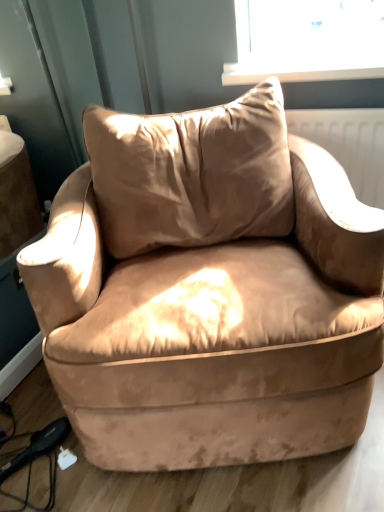
The image size is (384, 512). What do you see at coordinates (208, 291) in the screenshot?
I see `velvet beige armchair at center` at bounding box center [208, 291].

The height and width of the screenshot is (512, 384). I want to click on velvet beige armchair at center, so click(208, 291).

This screenshot has width=384, height=512. Find the location of `velvet beige armchair at center`. velvet beige armchair at center is located at coordinates (208, 291).